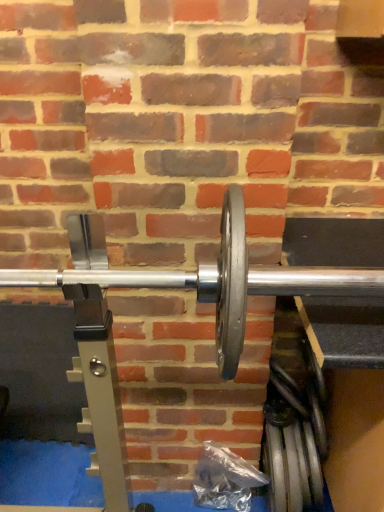
Question: Does point (276, 445) appear closer or farther from the camera than point (215, 295)?

Choices:
 (A) farther
 (B) closer

Answer: (A)

Question: In terms of height, does shiny metallic weight plate at lower right look taller or shorter compared to silver metallic dumbbell at center?

Choices:
 (A) tall
 (B) short

Answer: (A)

Question: Considering the positions of shiny metallic weight plate at lower right and silver metallic dumbbell at center in the image, is shiny metallic weight plate at lower right wider or thinner than silver metallic dumbbell at center?

Choices:
 (A) thin
 (B) wide

Answer: (A)

Question: From the image's perspective, is silver metallic dumbbell at center located above or below shiny metallic weight plate at lower right?

Choices:
 (A) below
 (B) above

Answer: (B)

Question: Would you say silver metallic dumbbell at center is to the left or to the right of shiny metallic weight plate at lower right in the picture?

Choices:
 (A) left
 (B) right

Answer: (A)

Question: From a real-world perspective, is silver metallic dumbbell at center above or below shiny metallic weight plate at lower right?

Choices:
 (A) above
 (B) below

Answer: (A)

Question: Considering the positions of point (87, 224) and point (306, 487), is point (87, 224) closer or farther from the camera than point (306, 487)?

Choices:
 (A) farther
 (B) closer

Answer: (B)